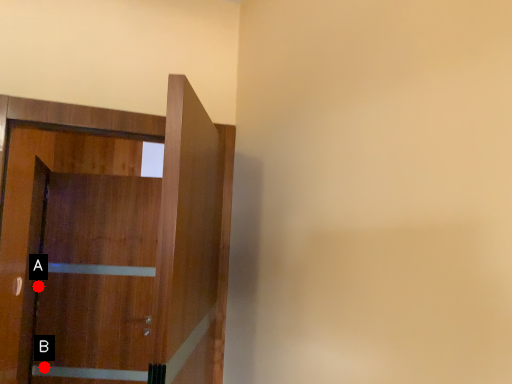
Question: Two points are circled on the image, labeled by A and B beside each circle. Among these points, which one is farthest from the camera?

Choices:
 (A) A is further
 (B) B is further

Answer: (A)